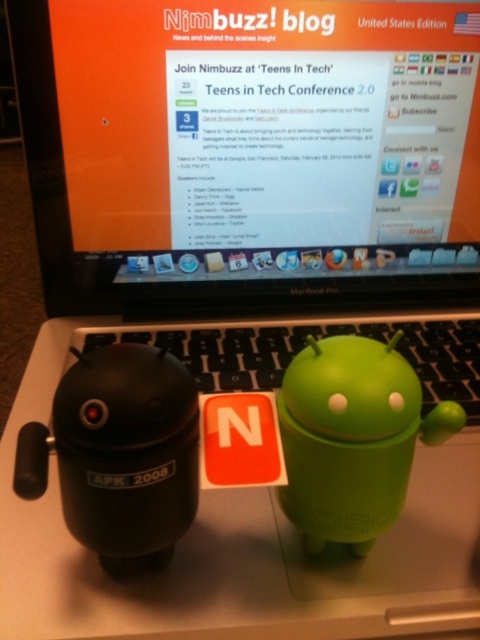
The height and width of the screenshot is (640, 480). What do you see at coordinates (244, 531) in the screenshot?
I see `matte plastic table at center` at bounding box center [244, 531].

Is point (70, 636) farther from viewer compared to point (300, 378)?

No, it is not.

Is point (101, 577) behind point (383, 404)?

Yes, point (101, 577) is behind point (383, 404).

Identify the location of matte plastic table at center. The width and height of the screenshot is (480, 640). (244, 531).

Identify the location of matte plastic table at center. (244, 531).

Is point (455, 540) behind point (159, 436)?

That is True.

Where is `matte plastic table at center`? This screenshot has height=640, width=480. matte plastic table at center is located at coordinates (244, 531).

Does matte black figurine at lower left appear under green matte android at center?

Correct, matte black figurine at lower left is located below green matte android at center.

Does matte black figurine at lower left appear over green matte android at center?

No.

Is point (122, 556) farther from camera compared to point (387, 499)?

No, it is in front of (387, 499).

The image size is (480, 640). What are the coordinates of `matte black figurine at lower left` in the screenshot? It's located at (120, 454).